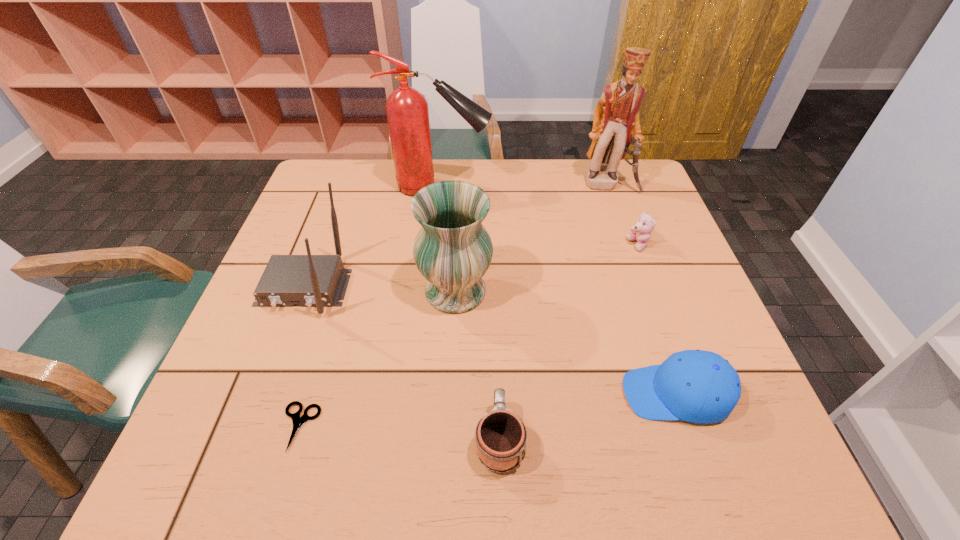
Locate an element on the screen. teddy bear situated at the right edge is located at coordinates (641, 232).

You are a GUI agent. You are given a task and a screenshot of the screen. Output one action in this format:
    pyautogui.click(x=<x>, y=<y>)
    Task: Click on the object that is at the near left corner
    Image resolution: width=960 pixels, height=540 pixels.
    Given the screenshot: What is the action you would take?
    pyautogui.click(x=298, y=421)

At what (x,y) coordinates should I click in order to perform the action: click on object that is positioned at the far right corner. Please return your answer as a coordinate pair (x, y). Looking at the image, I should click on (616, 123).

In the image, there is a desktop. Find the location of `vacant space at the far edge`. vacant space at the far edge is located at coordinates (516, 195).

Locate an element on the screen. The width and height of the screenshot is (960, 540). vacant area at the near edge of the desktop is located at coordinates (328, 461).

Identify the location of vacant space at the left edge. (300, 380).

The width and height of the screenshot is (960, 540). Find the location of `vacant space at the right edge of the desktop`. vacant space at the right edge of the desktop is located at coordinates (682, 267).

Identify the location of blank space at the far left corner. (324, 186).

You are a GUI agent. You are given a task and a screenshot of the screen. Output one action in this format:
    pyautogui.click(x=<x>, y=<y>)
    Task: Click on the free space at the far right corner of the desktop
    The image size is (960, 540).
    Given the screenshot: What is the action you would take?
    pyautogui.click(x=620, y=166)

In the image, there is a desktop. Where is `vacant space at the near right corner`? This screenshot has width=960, height=540. vacant space at the near right corner is located at coordinates (704, 451).